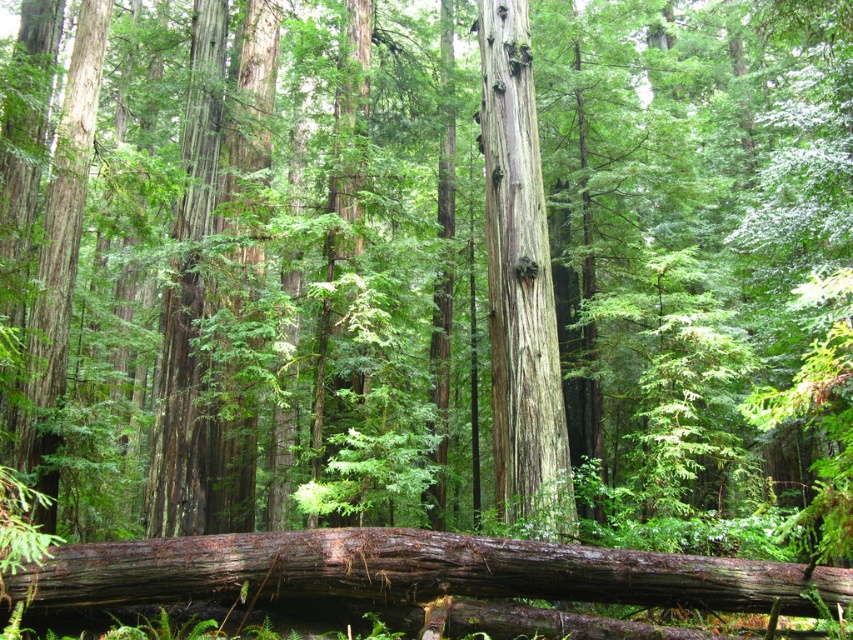
Is the position of rough bark log at center more distant than that of smooth gray bark at center?

No.

Which is above, rough bark log at center or smooth gray bark at center?

rough bark log at center is above.

Who is more distant from viewer, (135,573) or (502,164)?

Positioned behind is point (502,164).

Locate an element on the screen. The width and height of the screenshot is (853, 640). rough bark log at center is located at coordinates (413, 572).